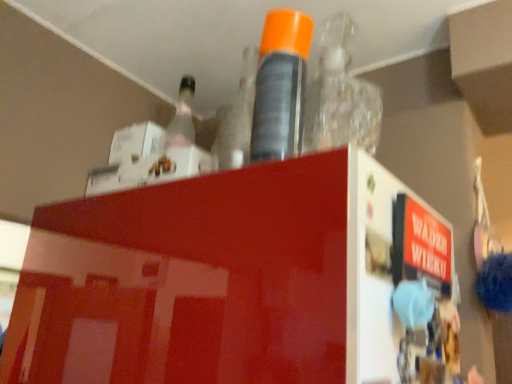
Question: Is orange cap spray can at center, the second bottle positioned from the left, looking in the opposite direction of transparent plastic bottle at upper center, which appears as the 3th bottle when viewed from the left?

Choices:
 (A) no
 (B) yes

Answer: (B)

Question: Is orange cap spray can at center, which is the second bottle from right to left, not within transparent plastic bottle at upper center, which appears as the 3th bottle when viewed from the left?

Choices:
 (A) yes
 (B) no

Answer: (A)

Question: Does orange cap spray can at center, which is the second bottle from right to left, appear on the right side of transparent plastic bottle at upper center, which appears as the 3th bottle when viewed from the left?

Choices:
 (A) no
 (B) yes

Answer: (A)

Question: Would you say orange cap spray can at center, the second bottle positioned from the left, is a long distance from transparent plastic bottle at upper center, which appears as the 3th bottle when viewed from the left?

Choices:
 (A) no
 (B) yes

Answer: (A)

Question: Does orange cap spray can at center, which is the second bottle from right to left, have a lesser height compared to transparent plastic bottle at upper center, which is the first bottle in right-to-left order?

Choices:
 (A) no
 (B) yes

Answer: (B)

Question: From a real-world perspective, is transparent plastic bottle at upper center, which is the first bottle in right-to-left order, positioned above or below clear plastic bottle at upper center, which is the first bottle from left to right?

Choices:
 (A) above
 (B) below

Answer: (A)

Question: Is point (327, 66) positioned closer to the camera than point (190, 99)?

Choices:
 (A) closer
 (B) farther

Answer: (A)

Question: From the image's perspective, is transparent plastic bottle at upper center, which is the first bottle in right-to-left order, positioned above or below clear plastic bottle at upper center, which is the first bottle from left to right?

Choices:
 (A) above
 (B) below

Answer: (A)

Question: Considering their positions, is transparent plastic bottle at upper center, which is the first bottle in right-to-left order, located in front of or behind clear plastic bottle at upper center, the third bottle when ordered from right to left?

Choices:
 (A) behind
 (B) front

Answer: (B)

Question: Considering the positions of orange cap spray can at center, the second bottle positioned from the left, and clear plastic bottle at upper center, which is the first bottle from left to right, in the image, is orange cap spray can at center, the second bottle positioned from the left, wider or thinner than clear plastic bottle at upper center, which is the first bottle from left to right,?

Choices:
 (A) wide
 (B) thin

Answer: (A)

Question: Is point (304, 62) closer or farther from the camera than point (170, 135)?

Choices:
 (A) farther
 (B) closer

Answer: (B)

Question: Considering the positions of orange cap spray can at center, which is the second bottle from right to left, and clear plastic bottle at upper center, which is the first bottle from left to right, in the image, is orange cap spray can at center, which is the second bottle from right to left, bigger or smaller than clear plastic bottle at upper center, which is the first bottle from left to right,?

Choices:
 (A) big
 (B) small

Answer: (B)

Question: Considering the relative positions of orange cap spray can at center, the second bottle positioned from the left, and clear plastic bottle at upper center, the third bottle when ordered from right to left, in the image provided, is orange cap spray can at center, the second bottle positioned from the left, to the left or to the right of clear plastic bottle at upper center, the third bottle when ordered from right to left,?

Choices:
 (A) left
 (B) right

Answer: (B)

Question: From a real-world perspective, is orange cap spray can at center, which is the second bottle from right to left, positioned above or below transparent plastic bottle at upper center, which is the first bottle in right-to-left order?

Choices:
 (A) above
 (B) below

Answer: (B)

Question: Is orange cap spray can at center, which is the second bottle from right to left, spatially inside transparent plastic bottle at upper center, which appears as the 3th bottle when viewed from the left, or outside of it?

Choices:
 (A) inside
 (B) outside

Answer: (B)